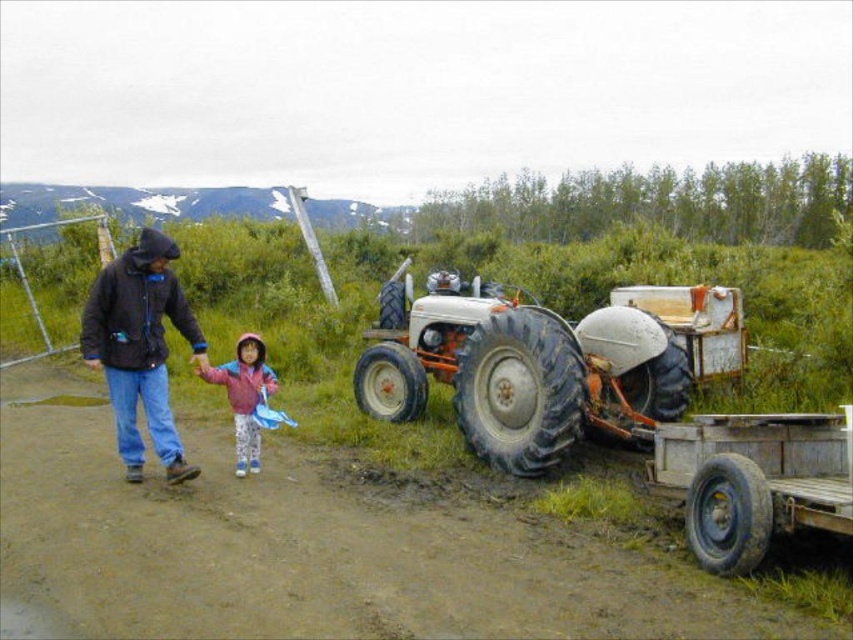
You are a photographer trying to capture a photo of the black matte jacket at left and the red fleece jacket at center. Based on their positions, which jacket should you focus on first to ensure both are in the frame?

The black matte jacket at left is in front of the red fleece jacket at center, so you should focus on the black matte jacket at left first to ensure both are in the frame.

You are standing at the point marked as point (519, 369). Which object is exactly at your current location?

The white rubber tractor at center is exactly at your current location marked as point (519, 369).

You are a photographer trying to capture a photo of the black matte jacket at left and the red fleece jacket at center. Based on their positions, which jacket should you focus on first to ensure both are in frame?

The black matte jacket at left is above the red fleece jacket at center, so you should focus on the red fleece jacket at center first to ensure both are in frame.